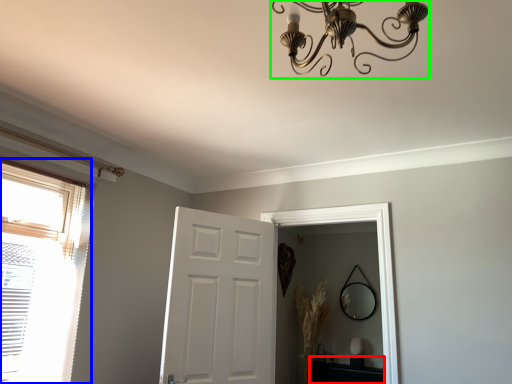
Question: Which object is the farthest from table (highlighted by a red box)? Choose among these: window (highlighted by a blue box) or light fixture (highlighted by a green box).

Choices:
 (A) window
 (B) light fixture

Answer: (B)